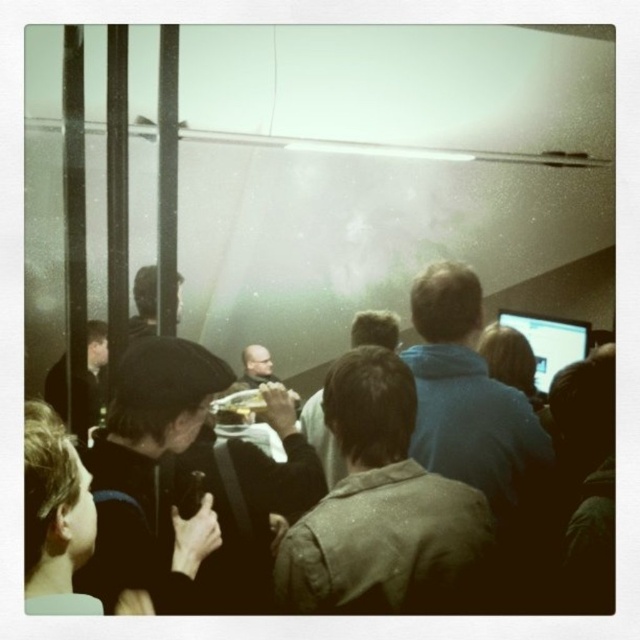
You are an event organizer and need to arrange seating for two attendees wearing jackets. The jackets are the dark brown leather jacket at left and the matte black jacket at center. Which jacket is smaller and should be seated in a smaller chair?

The dark brown leather jacket at left is smaller than the matte black jacket at center, so it should be seated in a smaller chair.

You are standing at the center of the room and want to reach the dark brown leather jacket at left. Which direction should you move to get there?

Since the dark brown leather jacket at left is located at point 0.575 on the x axis and 0.148 on the y axis, you should move to the left and slightly forward to reach it.